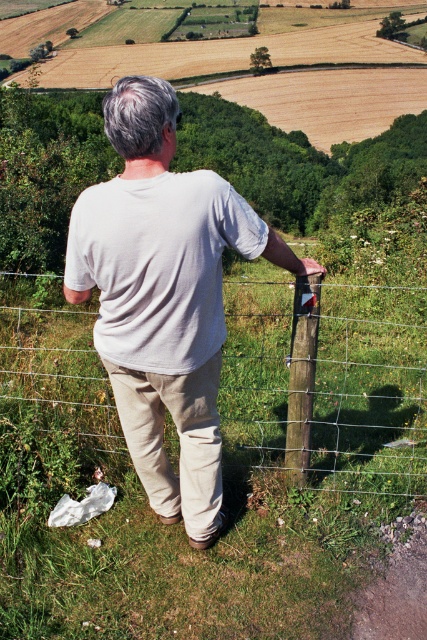
Can you confirm if white cotton shirt at center is wider than wooden post at center?

Yes, white cotton shirt at center is wider than wooden post at center.

Is point (160, 198) closer to camera compared to point (310, 340)?

Yes, it is.

Where is `white cotton shirt at center`? The image size is (427, 640). white cotton shirt at center is located at coordinates (x=163, y=296).

Identify the location of white cotton shirt at center. The width and height of the screenshot is (427, 640). (163, 296).

Is wire mesh fence at center below wooden post at center?

Indeed, wire mesh fence at center is positioned under wooden post at center.

Does wire mesh fence at center appear over wooden post at center?

No, wire mesh fence at center is not above wooden post at center.

Between point (242, 381) and point (289, 426), which one is positioned behind?

Point (242, 381)

At what (x,y) coordinates should I click in order to perform the action: click on wire mesh fence at center. Please return your answer as a coordinate pair (x, y). Looking at the image, I should click on (370, 392).

Which is more to the left, wire mesh fence at center or white cotton shirt at center?

Positioned to the left is white cotton shirt at center.

Between wire mesh fence at center and white cotton shirt at center, which one appears on the right side from the viewer's perspective?

Positioned to the right is wire mesh fence at center.

Locate an element on the screen. wire mesh fence at center is located at coordinates (370, 392).

Identify the location of wire mesh fence at center. (370, 392).